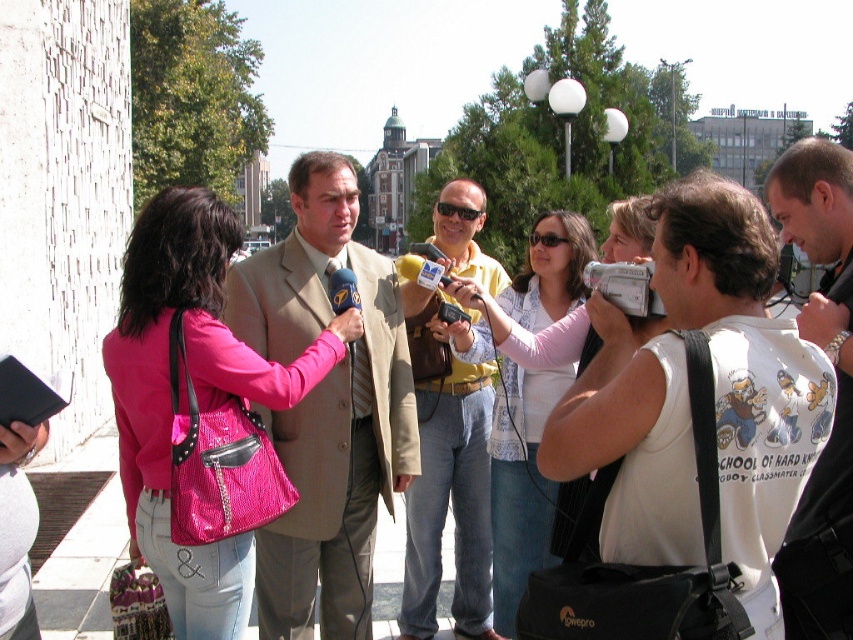
Question: In this image, where is pink snakeskin purse at center located relative to yellowmaterialshirt at center?

Choices:
 (A) left
 (B) right

Answer: (A)

Question: Which of the following is the closest to the observer?

Choices:
 (A) (195, 388)
 (B) (686, 557)
 (C) (248, 289)

Answer: (B)

Question: Which object is closer to the camera taking this photo?

Choices:
 (A) beige fabric suit at center
 (B) white printed t-shirt at center

Answer: (B)

Question: Which object is positioned farthest from the white cotton tank top at center?

Choices:
 (A) pink snakeskin purse at center
 (B) beige fabric suit at center
 (C) light pink fabric shirt at center
 (D) white printed t-shirt at center

Answer: (A)

Question: Does white printed t-shirt at center lie behind light pink fabric shirt at center?

Choices:
 (A) no
 (B) yes

Answer: (A)

Question: Does pink snakeskin purse at center appear under yellowmaterialshirt at center?

Choices:
 (A) no
 (B) yes

Answer: (B)